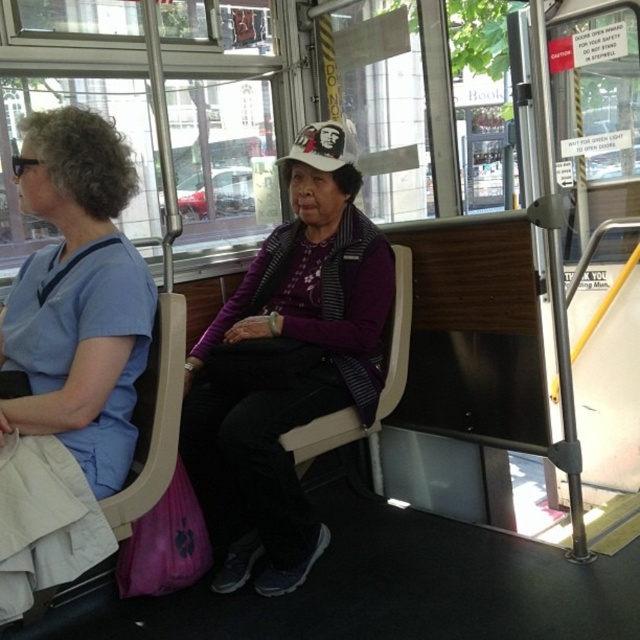
You are a passenger on a bus and you see a person wearing blue scrubs at left and another person wearing a purple matte sweater at center. Which clothing item is located lower in the image?

The purple matte sweater at center is below the blue scrubs at left, so the purple matte sweater at center is located lower in the image.

You are a passenger on a bus and you see the purple matte sweater at center and the blue scrubs at left. Which object is closer to you?

The purple matte sweater at center is closer to you because it is further to the viewer than the blue scrubs at left.